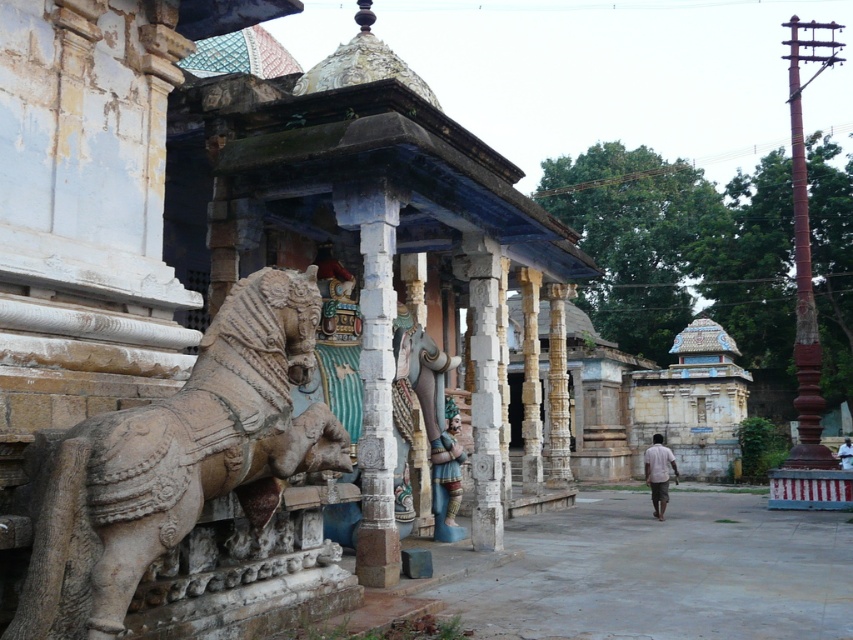
Question: Which point is closer to the camera?

Choices:
 (A) light brown cotton shirt at center
 (B) rusty metal pole at right
 (C) white clothed person at center
 (D) polychrome painted statue at center

Answer: (D)

Question: Estimate the real-world distances between objects in this image. Which object is farther from the stone carved horse at left?

Choices:
 (A) polychrome painted statue at center
 (B) white stone pillar at center
 (C) white clothed person at center

Answer: (C)

Question: Does white stone pillar at center appear under polychrome painted statue at center?

Choices:
 (A) no
 (B) yes

Answer: (A)

Question: Can you confirm if polychrome painted statue at center is wider than white clothed person at center?

Choices:
 (A) yes
 (B) no

Answer: (B)

Question: Which of the following is the farthest from the observer?

Choices:
 (A) (213, 332)
 (B) (807, 209)

Answer: (B)

Question: From the image, what is the correct spatial relationship of rusty metal pole at right in relation to light brown cotton shirt at center?

Choices:
 (A) above
 (B) below

Answer: (A)